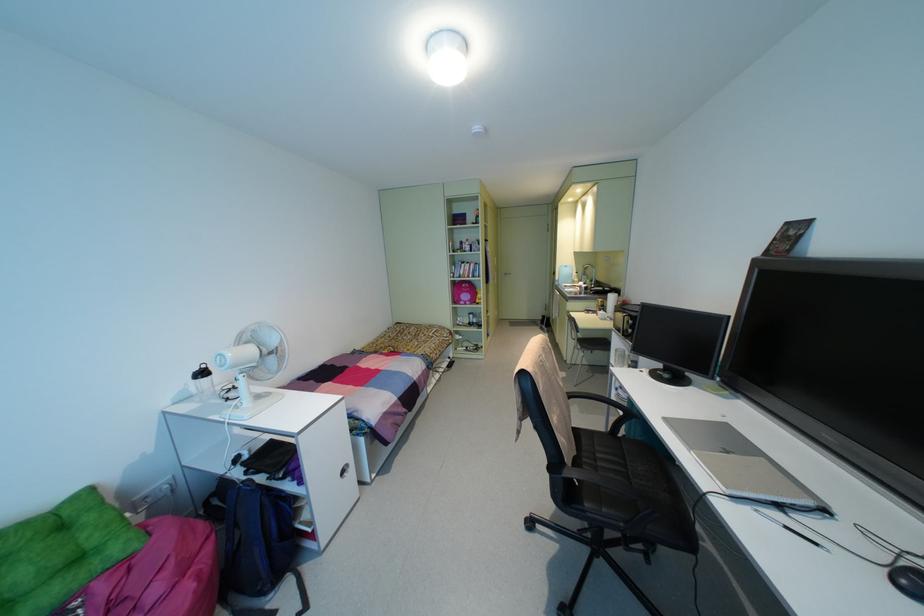
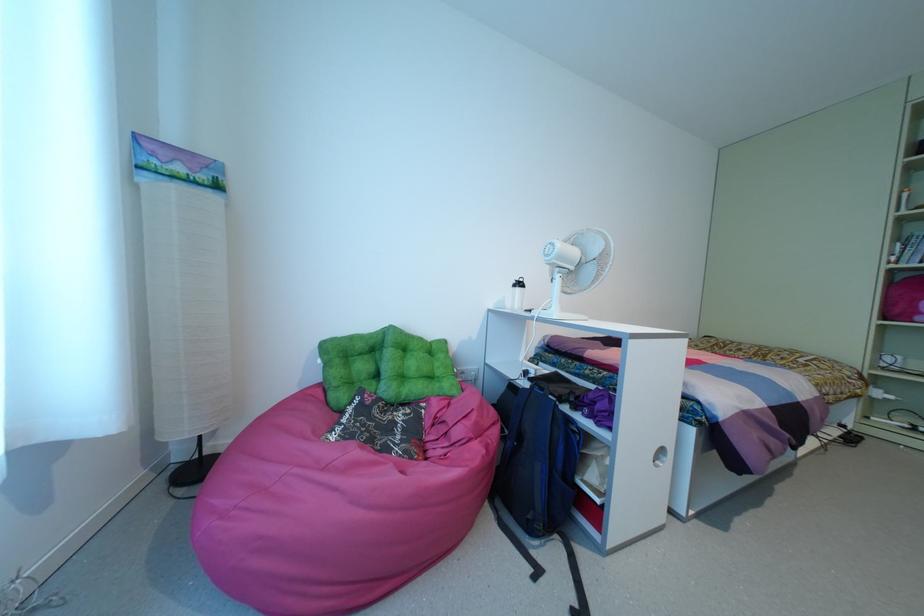
Where in the second image is the point corresponding to (x=228, y=354) from the first image?

(556, 244)